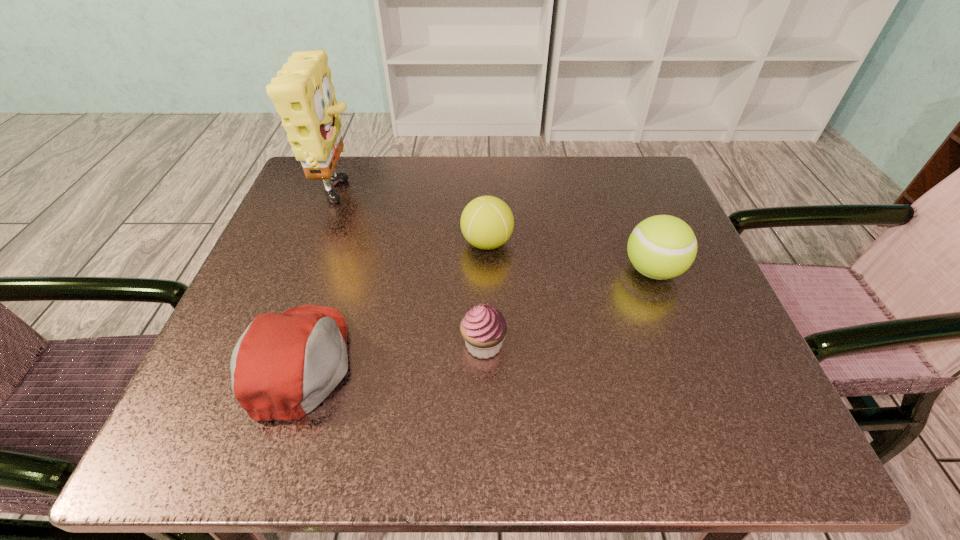
Locate an element on the screen. object that is the nearest to the cap is located at coordinates [x=483, y=328].

At what (x,y) coordinates should I click in order to perform the action: click on object that stands as the second closest to the rightmost object. Please return your answer as a coordinate pair (x, y). Image resolution: width=960 pixels, height=540 pixels. Looking at the image, I should click on (483, 328).

In order to click on vacant space that satisfies the following two spatial constraints: 1. on the face of the cupcake; 2. on the left side of the sponge in this screenshot , I will do `click(283, 345)`.

Find the location of a particular element. This screenshot has width=960, height=540. free space that satisfies the following two spatial constraints: 1. on the front side of the rightmost object; 2. on the front-facing side of the cap is located at coordinates (687, 362).

You are a GUI agent. You are given a task and a screenshot of the screen. Output one action in this format:
    pyautogui.click(x=<x>, y=<y>)
    Task: Click on the vacant position in the image that satisfies the following two spatial constraints: 1. on the face of the tallest object; 2. on the back side of the rightmost object
    The height and width of the screenshot is (540, 960).
    Given the screenshot: What is the action you would take?
    pyautogui.click(x=311, y=271)

At what (x,y) coordinates should I click in order to perform the action: click on free spot that satisfies the following two spatial constraints: 1. on the face of the sponge; 2. on the left side of the left tennis ball. Please return your answer as a coordinate pair (x, y). This screenshot has height=540, width=960. Looking at the image, I should click on pos(322,243).

Where is `free point that satisfies the following two spatial constraints: 1. on the face of the sponge; 2. on the left side of the cupcake`? free point that satisfies the following two spatial constraints: 1. on the face of the sponge; 2. on the left side of the cupcake is located at coordinates (283, 345).

At what (x,y) coordinates should I click in order to perform the action: click on vacant space that satisfies the following two spatial constraints: 1. on the front side of the rightmost object; 2. on the front-facing side of the cap. Please return your answer as a coordinate pair (x, y). This screenshot has width=960, height=540. Looking at the image, I should click on (687, 362).

Image resolution: width=960 pixels, height=540 pixels. Find the location of `free location that satisfies the following two spatial constraints: 1. on the face of the tallest object; 2. on the right side of the left tennis ball`. free location that satisfies the following two spatial constraints: 1. on the face of the tallest object; 2. on the right side of the left tennis ball is located at coordinates (322, 243).

Locate an element on the screen. The image size is (960, 540). vacant space that satisfies the following two spatial constraints: 1. on the face of the sponge; 2. on the left side of the rightmost object is located at coordinates pos(311,271).